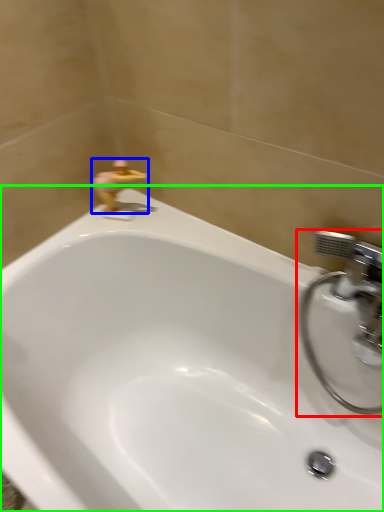
Question: Which object is positioned farthest from tap (highlighted by a red box)? Select from plumbing fixture (highlighted by a blue box) and bathtub (highlighted by a green box).

Choices:
 (A) plumbing fixture
 (B) bathtub

Answer: (A)